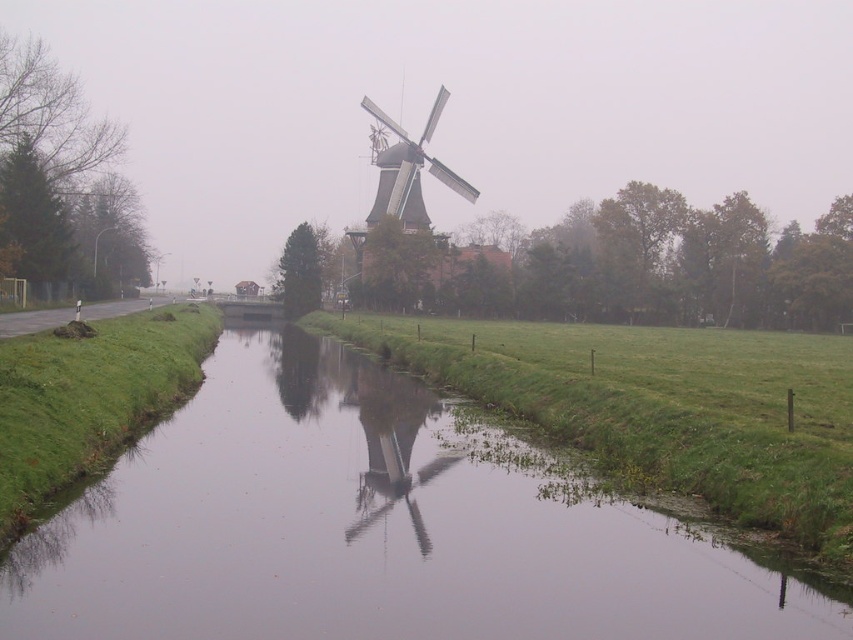
You are standing at the edge of the green grassy stream at center and want to throw a small stone to the waterway behind the windmill. Considering the distance between you and the stream, can you estimate if you can reach the waterway with a single throw?

The distance between the green grassy stream at center and the viewer is 6.56 meters. Since the waterway is behind the windmill, which is further away, you would need to throw the stone beyond the stream. However, the given distance only accounts for the stream to the viewer, not the total distance to the waterway. Therefore, it is uncertain if a single throw would be sufficient.